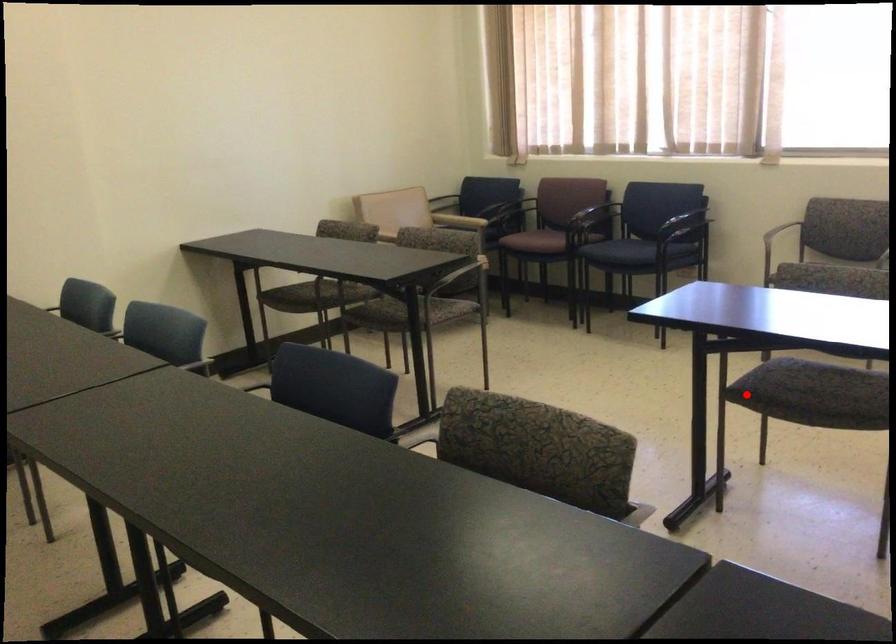
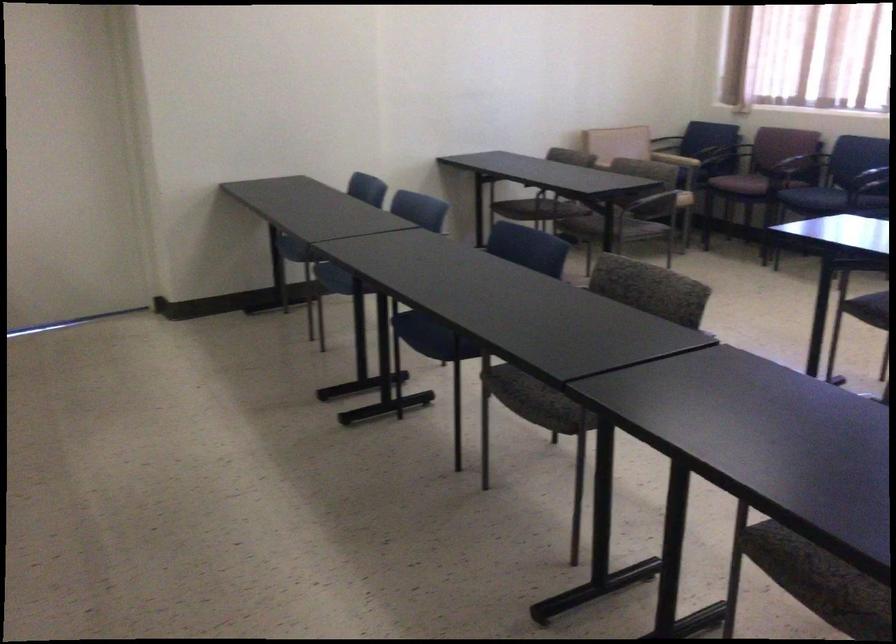
Question: I am providing you with two images of the same scene from different viewpoints. Given a red point in image1, look at the same physical point in image2. Is it:

Choices:
 (A) Closer to the viewpoint
 (B) Farther from the viewpoint

Answer: (B)